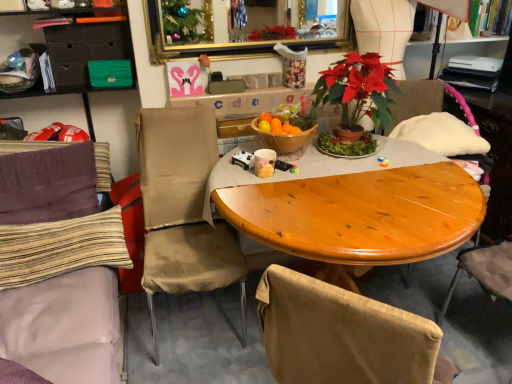
Locate an element on the screen. This screenshot has height=384, width=512. floral-patterned ceramic mug at center is located at coordinates (264, 162).

This screenshot has width=512, height=384. Describe the element at coordinates (229, 42) in the screenshot. I see `gold-framed mirror at upper center` at that location.

Image resolution: width=512 pixels, height=384 pixels. I want to click on beige fabric chair at center, the first chair positioned from the right, so click(183, 210).

At what (x,y) coordinates should I click in order to perform the action: click on wooden bowl at center. Please return your answer as a coordinate pair (x, y). The image size is (512, 384). Looking at the image, I should click on (285, 142).

What is the approximate width of matte black drawer at upper left?

It is 1.39 inches.

Describe the element at coordinates (61, 248) in the screenshot. The height and width of the screenshot is (384, 512). I see `striped fabric pillow at left, the first pillow from the bottom` at that location.

Where is `purple knitted pillow at left, the first pillow when ordered from top to bottom`? The height and width of the screenshot is (384, 512). purple knitted pillow at left, the first pillow when ordered from top to bottom is located at coordinates (48, 185).

What are the coordinates of `purple knit fabric at left, marked as the 2th chair in a right-to-left arrangement` in the screenshot? It's located at (54, 242).

Who is bigger, beige fabric chair at center, which is the 2th chair from left to right, or matte black drawer at upper left?

beige fabric chair at center, which is the 2th chair from left to right, is bigger.

Is point (138, 122) closer to camera compared to point (83, 29)?

That is True.

Are beige fabric chair at center, which is the 2th chair from left to right, and matte black drawer at upper left far apart?

No, beige fabric chair at center, which is the 2th chair from left to right, is in close proximity to matte black drawer at upper left.

Is beige fabric chair at center, which is the 2th chair from left to right, wider than matte black drawer at upper left?

Indeed, beige fabric chair at center, which is the 2th chair from left to right, has a greater width compared to matte black drawer at upper left.

Between wooden armchair at right and floral-patterned ceramic mug at center, which one is positioned in front?

Positioned in front is floral-patterned ceramic mug at center.

Is wooden armchair at right surrounding floral-patterned ceramic mug at center?

Definitely not — floral-patterned ceramic mug at center is not inside wooden armchair at right.

At what (x,y) coordinates should I click in order to perform the action: click on armchair above the floral-patterned ceramic mug at center (from the image's perspective). Please return your answer as a coordinate pair (x, y). Looking at the image, I should click on (463, 108).

Considering the positions of points (477, 126) and (262, 164), is point (477, 126) farther from camera compared to point (262, 164)?

Yes, point (477, 126) is behind point (262, 164).

Consider the image. Which is more to the right, beige fabric chair at center, the first chair positioned from the right, or wooden armchair at right?

wooden armchair at right is more to the right.

Between point (196, 175) and point (462, 105), which one is positioned in front?

The point (196, 175) is closer.

Choose the correct answer: Is beige fabric chair at center, the first chair positioned from the right, inside wooden armchair at right or outside it?

beige fabric chair at center, the first chair positioned from the right, is not enclosed by wooden armchair at right.

Is beige fabric chair at center, which is the 2th chair from left to right, oriented towards wooden armchair at right?

No, beige fabric chair at center, which is the 2th chair from left to right, is not oriented towards wooden armchair at right.

Is wooden bowl at center shorter than floral-patterned ceramic mug at center?

No, wooden bowl at center is not shorter than floral-patterned ceramic mug at center.

Is wooden bowl at center beside floral-patterned ceramic mug at center?

No, wooden bowl at center is not with floral-patterned ceramic mug at center.

Considering the relative positions of wooden bowl at center and floral-patterned ceramic mug at center in the image provided, is wooden bowl at center to the left of floral-patterned ceramic mug at center from the viewer's perspective?

No, wooden bowl at center is not to the left of floral-patterned ceramic mug at center.

Consider the image. Looking at their sizes, would you say wooden bowl at center is wider or thinner than floral-patterned ceramic mug at center?

In the image, wooden bowl at center appears to be wider than floral-patterned ceramic mug at center.

From the image's perspective, which one is positioned higher, purple knit fabric at left, marked as the 2th chair in a right-to-left arrangement, or wooden bowl at center?

wooden bowl at center appears higher in the image.

Could you tell me if purple knit fabric at left, marked as the 2th chair in a right-to-left arrangement, is facing wooden bowl at center?

Yes, purple knit fabric at left, marked as the 2th chair in a right-to-left arrangement, faces towards wooden bowl at center.

Can you confirm if purple knit fabric at left, positioned as the 1th chair in left-to-right order, is positioned to the left of wooden bowl at center?

Correct, you'll find purple knit fabric at left, positioned as the 1th chair in left-to-right order, to the left of wooden bowl at center.

Is purple knit fabric at left, positioned as the 1th chair in left-to-right order, positioned far away from wooden bowl at center?

No, purple knit fabric at left, positioned as the 1th chair in left-to-right order, is not far away from wooden bowl at center.

How many degrees apart are the facing directions of purple knitted pillow at left, which ranks as the 2th pillow in bottom-to-top order, and striped fabric pillow at left, marked as the second pillow in a top-to-bottom arrangement?

purple knitted pillow at left, which ranks as the 2th pillow in bottom-to-top order, and striped fabric pillow at left, marked as the second pillow in a top-to-bottom arrangement, are facing 0.000938 degrees away from each other.

Is purple knitted pillow at left, which ranks as the 2th pillow in bottom-to-top order, looking in the opposite direction of striped fabric pillow at left, marked as the second pillow in a top-to-bottom arrangement?

No.

Which is further, (28,163) or (78,269)?

The point (28,163) is behind.

Based on their sizes in the image, would you say purple knitted pillow at left, which ranks as the 2th pillow in bottom-to-top order, is bigger or smaller than striped fabric pillow at left, marked as the second pillow in a top-to-bottom arrangement?

purple knitted pillow at left, which ranks as the 2th pillow in bottom-to-top order, is bigger than striped fabric pillow at left, marked as the second pillow in a top-to-bottom arrangement.

Who is bigger, beige fabric chair at center, the first chair positioned from the right, or wooden bowl at center?

beige fabric chair at center, the first chair positioned from the right.

Is beige fabric chair at center, which is the 2th chair from left to right, aimed at wooden bowl at center?

No, beige fabric chair at center, which is the 2th chair from left to right, is not oriented towards wooden bowl at center.

Between beige fabric chair at center, the first chair positioned from the right, and wooden bowl at center, which one appears on the right side from the viewer's perspective?

wooden bowl at center.

The height and width of the screenshot is (384, 512). Identify the location of chair on the right of matte black drawer at upper left. (183, 210).

This screenshot has height=384, width=512. Identify the location of coffee cup that appears in front of the wooden armchair at right. (264, 162).

Considering their positions, is gold-framed mirror at upper center positioned further to striped fabric pillow at left, marked as the second pillow in a top-to-bottom arrangement, than wooden bowl at center?

The object further to striped fabric pillow at left, marked as the second pillow in a top-to-bottom arrangement, is gold-framed mirror at upper center.

Looking at this image, based on their spatial positions, is wooden bowl at center or striped fabric pillow at left, the first pillow from the bottom, closer to beige fabric chair at center, the first chair positioned from the right?

Based on the image, striped fabric pillow at left, the first pillow from the bottom, appears to be nearer to beige fabric chair at center, the first chair positioned from the right.

Looking at the image, which one is located further to wooden armchair at right, wooden bowl at center or floral-patterned ceramic mug at center?

floral-patterned ceramic mug at center.

From the image, which object appears to be farther from beige fabric chair at center, which is the 2th chair from left to right, wooden bowl at center or wooden armchair at right?

wooden armchair at right lies further to beige fabric chair at center, which is the 2th chair from left to right, than the other object.

When comparing their distances from wooden bowl at center, does striped fabric pillow at left, marked as the second pillow in a top-to-bottom arrangement, or wooden armchair at right seem further?

wooden armchair at right lies further to wooden bowl at center than the other object.

Considering their positions, is gold-framed mirror at upper center positioned further to beige fabric chair at center, which is the 2th chair from left to right, than purple knit fabric at left, marked as the 2th chair in a right-to-left arrangement?

gold-framed mirror at upper center.

Estimate the real-world distances between objects in this image. Which object is closer to beige fabric chair at center, which is the 2th chair from left to right, wooden bowl at center or matte black drawer at upper left?

wooden bowl at center is positioned closer to the anchor beige fabric chair at center, which is the 2th chair from left to right.

Considering their positions, is beige fabric chair at center, the first chair positioned from the right, positioned closer to matte black drawer at upper left than floral-patterned ceramic mug at center?

Based on the image, beige fabric chair at center, the first chair positioned from the right, appears to be nearer to matte black drawer at upper left.

Find the location of `mirror located between purple knitted pillow at left, which ranks as the 2th pillow in bottom-to-top order, and wooden armchair at right in the left-right direction`. mirror located between purple knitted pillow at left, which ranks as the 2th pillow in bottom-to-top order, and wooden armchair at right in the left-right direction is located at coordinates (229, 42).

This screenshot has height=384, width=512. I want to click on chair between matte black drawer at upper left and wooden armchair at right from left to right, so click(183, 210).

Identify the location of pillow between purple knitted pillow at left, which ranks as the 2th pillow in bottom-to-top order, and beige fabric chair at center, the first chair positioned from the right, in the horizontal direction. (61, 248).

At what (x,y) coordinates should I click in order to perform the action: click on chair between matte black drawer at upper left and wooden bowl at center from left to right. Please return your answer as a coordinate pair (x, y). This screenshot has width=512, height=384. Looking at the image, I should click on (183, 210).